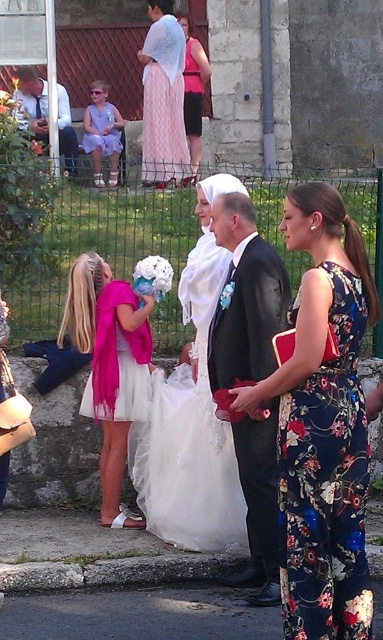
Question: Does shiny black suit at center appear on the right side of pink satin dress at center?

Choices:
 (A) yes
 (B) no

Answer: (A)

Question: Among these objects, which one is nearest to the camera?

Choices:
 (A) floral print dress at center
 (B) pink satin dress at center

Answer: (A)

Question: Which of the following is the closest to the observer?

Choices:
 (A) matte purple dress at upper left
 (B) floral print dress at center
 (C) matte black suit at upper left

Answer: (B)

Question: Which object is farther from the camera taking this photo?

Choices:
 (A) matte black suit at upper left
 (B) matte pink dress at center

Answer: (B)

Question: Is white tulle wedding dress at center to the left of matte black suit at upper left from the viewer's perspective?

Choices:
 (A) yes
 (B) no

Answer: (B)

Question: Is matte black suit at upper left in front of matte purple dress at upper left?

Choices:
 (A) no
 (B) yes

Answer: (B)